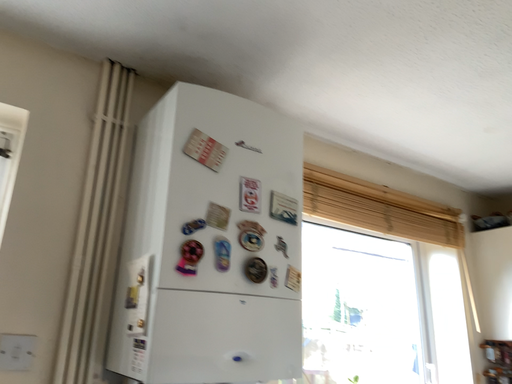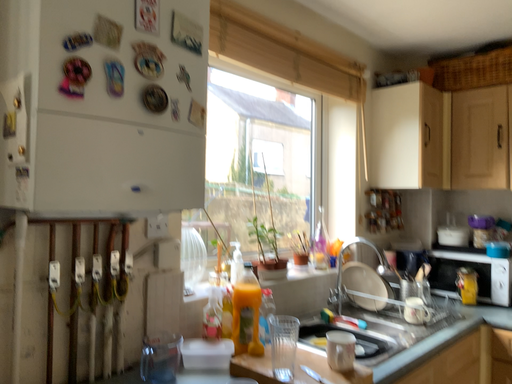
Question: How did the camera likely rotate when shooting the video?

Choices:
 (A) rotated right
 (B) rotated left

Answer: (A)